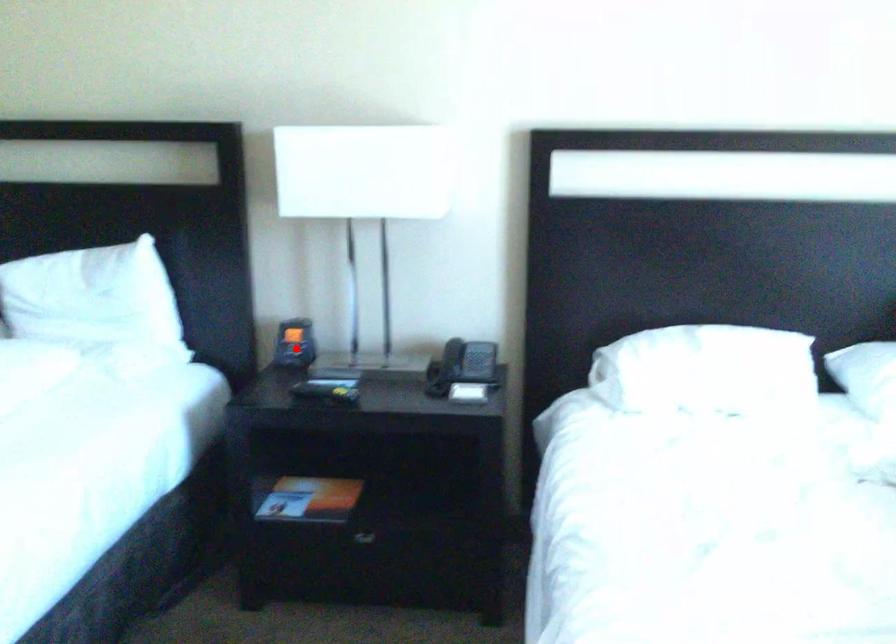
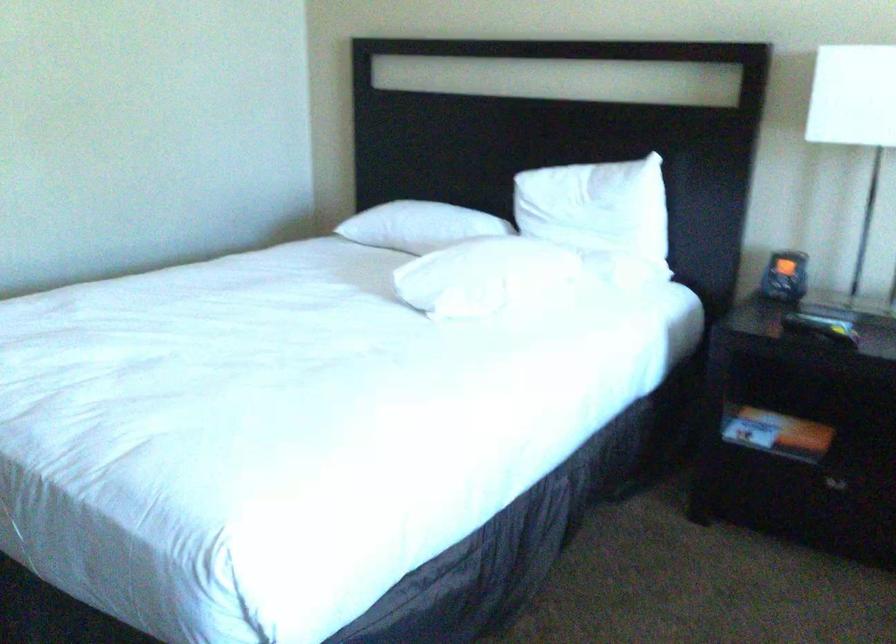
Find the pixel in the second image that matches the highlighted location in the first image.

(785, 276)